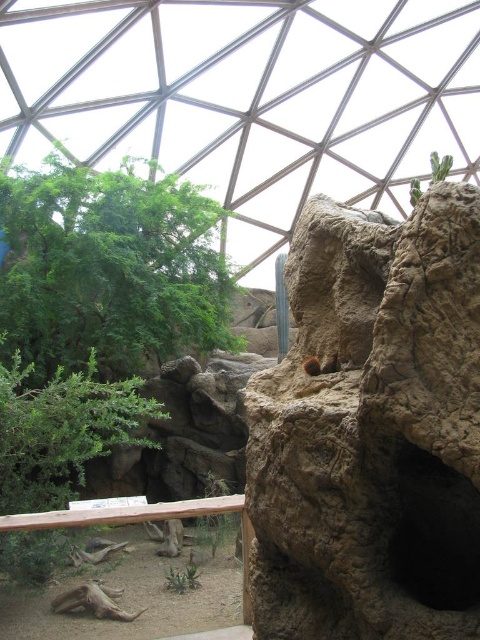
Is green leafy tree at upper left smaller than green leafy tree at lower left?

No, green leafy tree at upper left is not smaller than green leafy tree at lower left.

Who is more forward, (90,177) or (45,486)?

Positioned in front is point (45,486).

Where is `green leafy tree at upper left`? The height and width of the screenshot is (640, 480). green leafy tree at upper left is located at coordinates [108, 268].

Which is in front, point (296, 314) or point (211, 211)?

Point (296, 314) is in front.

Is brown rough rock at center below green leafy tree at upper left?

Correct, brown rough rock at center is located below green leafy tree at upper left.

The width and height of the screenshot is (480, 640). What are the coordinates of `brown rough rock at center` in the screenshot? It's located at (372, 429).

Is brown rough rock at center positioned behind green leafy tree at lower left?

No, it is in front of green leafy tree at lower left.

Between brown rough rock at center and green leafy tree at lower left, which one is positioned higher?

Positioned higher is brown rough rock at center.

You are a GUI agent. You are given a task and a screenshot of the screen. Output one action in this format:
    pyautogui.click(x=<x>, y=<y>)
    Task: Click on the brown rough rock at center
    The width and height of the screenshot is (480, 640).
    Given the screenshot: What is the action you would take?
    pyautogui.click(x=372, y=429)